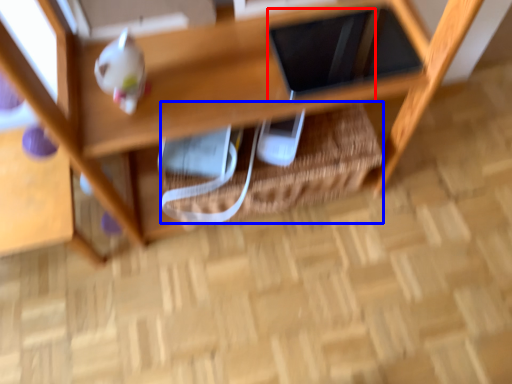
Question: Which object is further to the camera taking this photo, tablet computer (highlighted by a red box) or basket (highlighted by a blue box)?

Choices:
 (A) tablet computer
 (B) basket

Answer: (B)